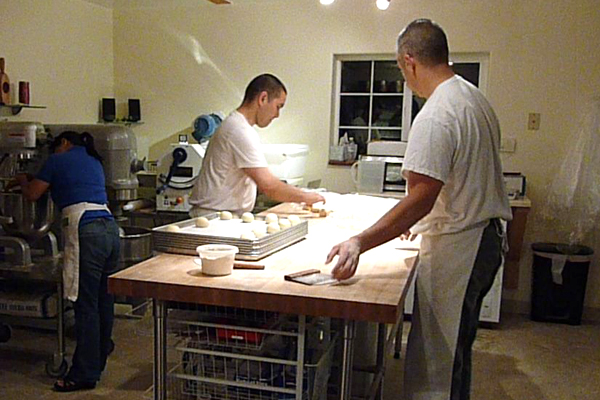
Locate an element on the screen. The width and height of the screenshot is (600, 400). floor is located at coordinates (568, 352).